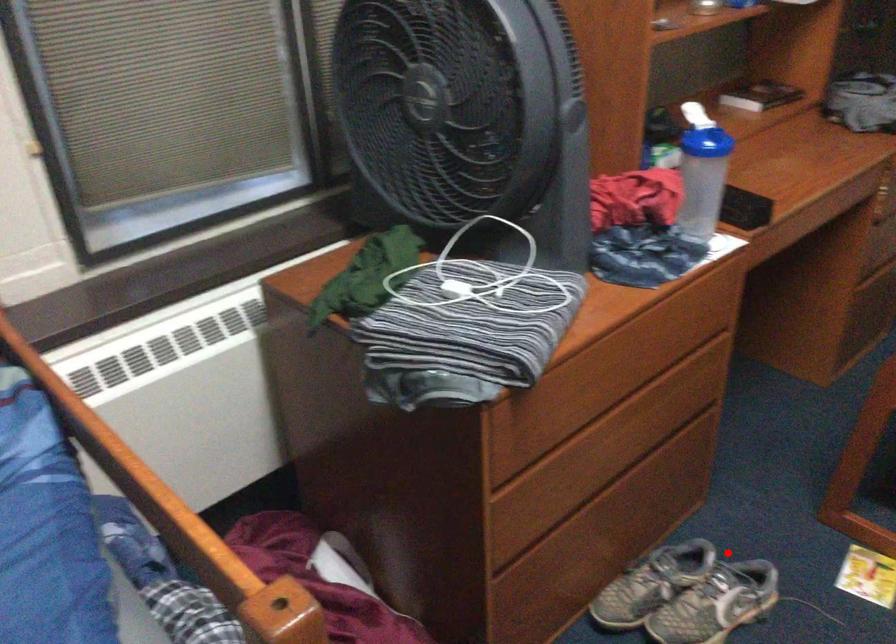
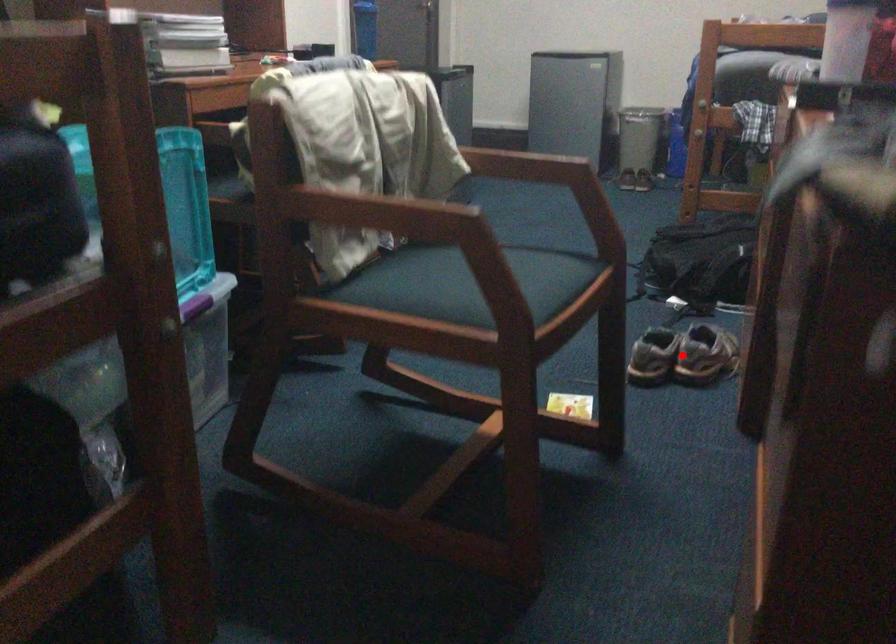
I am providing you with two images of the same scene from different viewpoints. A red point is marked on the first image and another point is marked on the second image. Are the points marked in image1 and image2 representing the same 3D position?

Yes